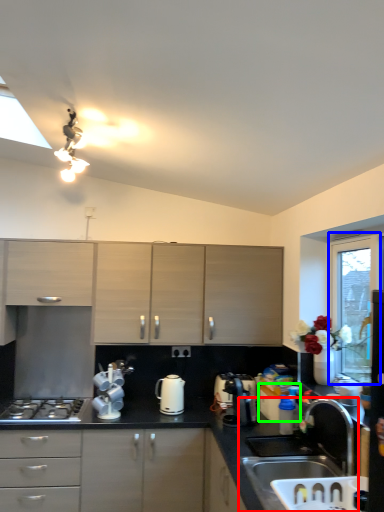
Question: Which object is the farthest from sink (highlighted by a red box)? Choose among these: window screen (highlighted by a blue box) or appliance (highlighted by a green box).

Choices:
 (A) window screen
 (B) appliance

Answer: (A)